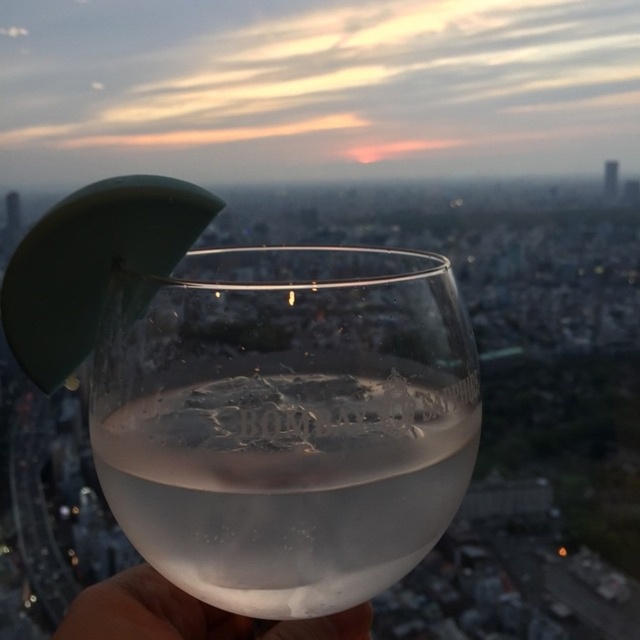
Question: Can you confirm if clear glass at center is bigger than white matte hand at lower left?

Choices:
 (A) yes
 (B) no

Answer: (A)

Question: Is clear glass at center above white matte hand at lower left?

Choices:
 (A) no
 (B) yes

Answer: (B)

Question: Does clear glass at center have a lesser width compared to white matte hand at lower left?

Choices:
 (A) no
 (B) yes

Answer: (A)

Question: Which point is closer to the camera?

Choices:
 (A) (461, 332)
 (B) (116, 637)

Answer: (A)

Question: Which object is closer to the camera taking this photo?

Choices:
 (A) clear glass at center
 (B) white matte hand at lower left

Answer: (A)